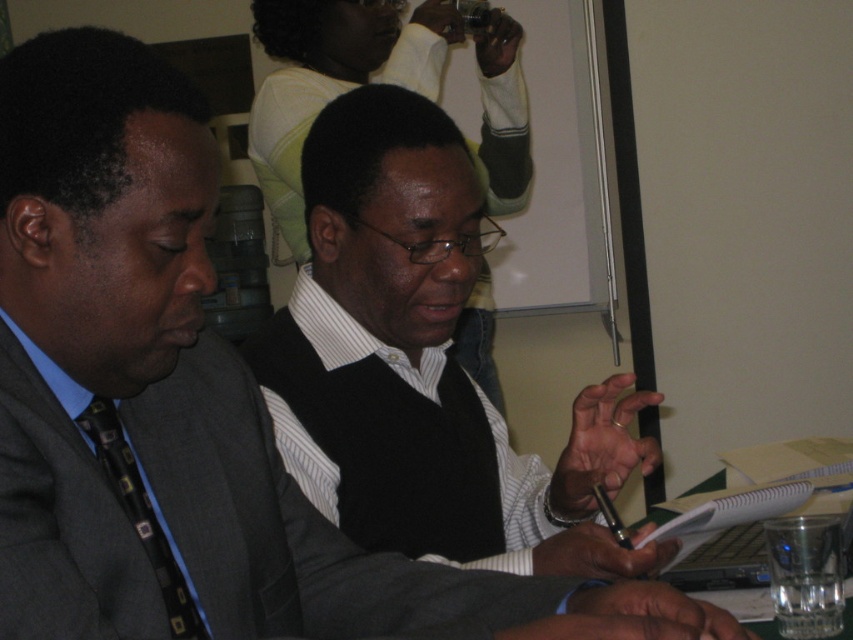
Question: Based on their relative distances, which object is nearer to the black matte vest at center?

Choices:
 (A) black printed tie at left
 (B) dark gray suit at left

Answer: (B)

Question: Which object appears closest to the camera in this image?

Choices:
 (A) black printed tie at left
 (B) dark gray suit at left

Answer: (B)

Question: Is dark gray suit at left to the left of black printed tie at left from the viewer's perspective?

Choices:
 (A) yes
 (B) no

Answer: (B)

Question: Estimate the real-world distances between objects in this image. Which object is closer to the black printed tie at left?

Choices:
 (A) black matte vest at center
 (B) dark gray suit at left

Answer: (B)

Question: Does black matte vest at center appear on the left side of dark gray suit at left?

Choices:
 (A) no
 (B) yes

Answer: (A)

Question: Can you confirm if black matte vest at center is positioned below dark gray suit at left?

Choices:
 (A) no
 (B) yes

Answer: (A)